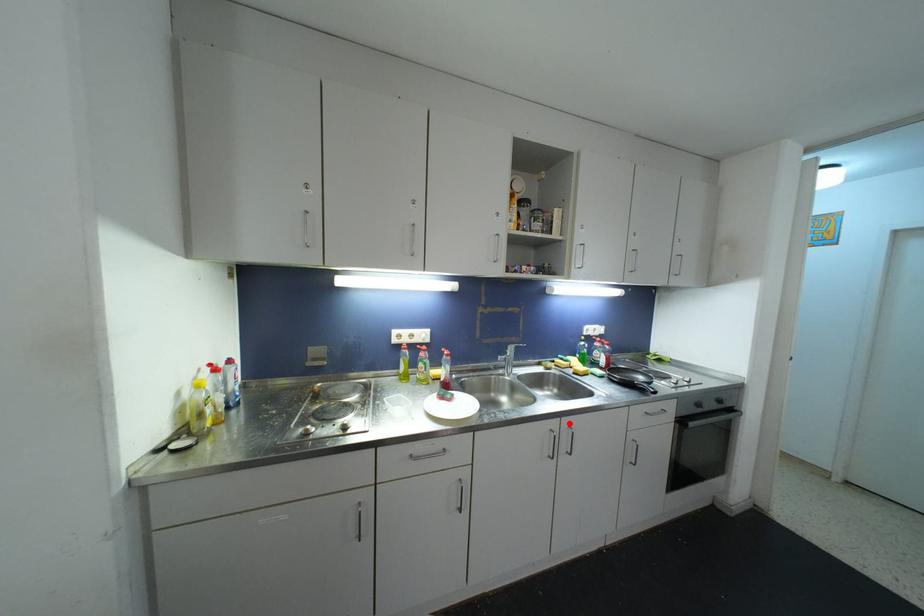
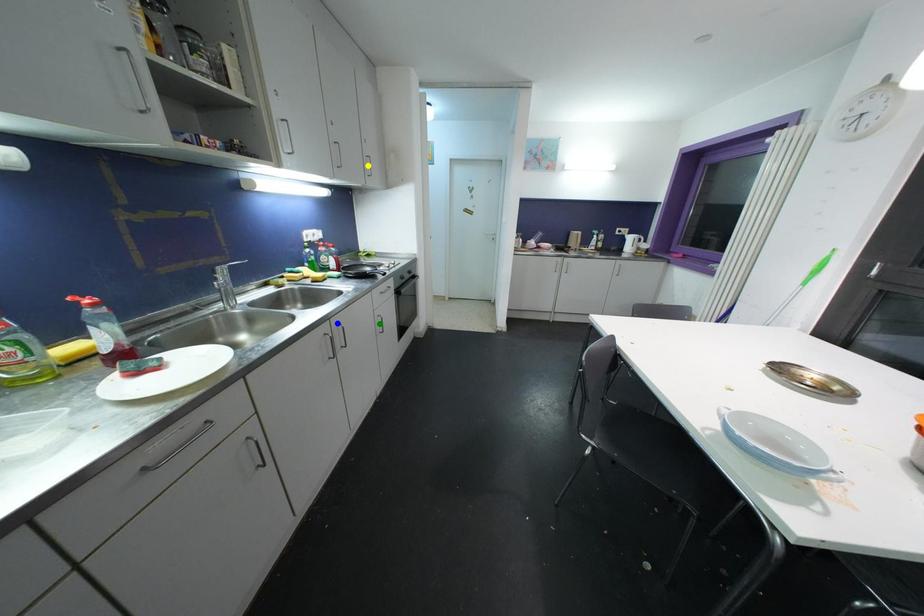
Question: I am providing you with two images of the same scene from different viewpoints. A red point is marked on the first image. You are given multiple points on the second image. Which point in image 2 is actually the same real-world point as the red point in image 1?

Choices:
 (A) green point
 (B) blue point
 (C) yellow point

Answer: (B)